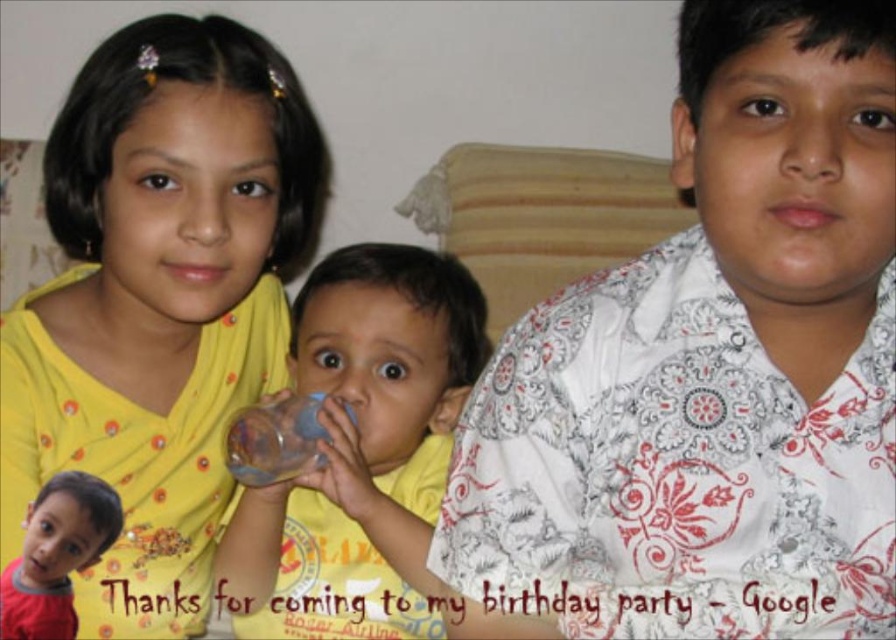
Based on the photo, you are a photographer setting up a shoot in this scene. You want to place a small prop between the yellow fabric at upper left and the red cotton shirt at lower left. Which object should the prop be placed closer to in order to ensure it is visible in the photo?

The yellow fabric at upper left is closer to the viewer than the red cotton shirt at lower left, so placing the prop closer to the yellow fabric at upper left will make it more visible in the photo.

You are a photographer setting up a shoot. You need to ensure that the white printed shirt at center and the transparent plastic cup at center are both visible in the frame. Given their widths, which object requires more horizontal space to fully capture in the photo?

The white printed shirt at center requires more horizontal space because its width surpasses that of the transparent plastic cup at center.